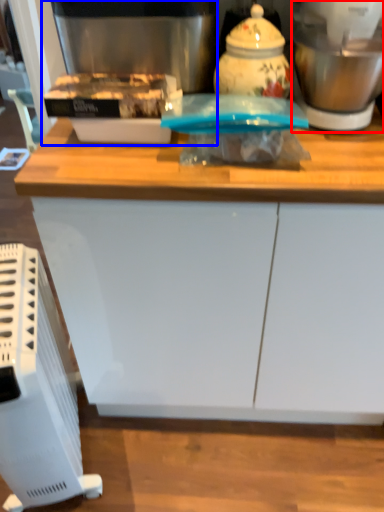
Question: Which object is closer to the camera taking this photo, blender (highlighted by a red box) or coffee machine (highlighted by a blue box)?

Choices:
 (A) blender
 (B) coffee machine

Answer: (A)